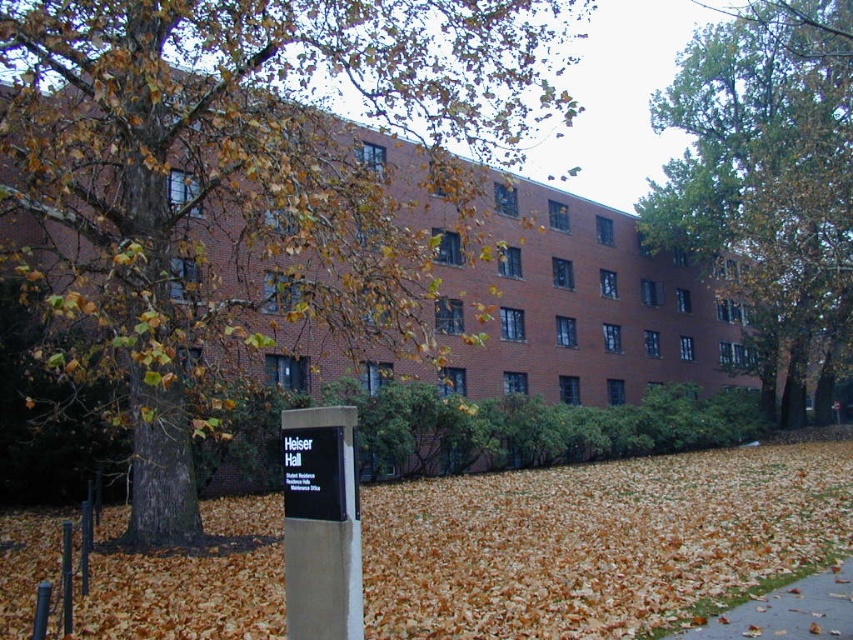
Based on the photo, is brown leafy tree at center behind brown leaf litter at lower center?

Yes, brown leafy tree at center is further from the viewer.

Is point (483, 115) positioned after point (231, 528)?

Yes, point (483, 115) is farther from viewer.

The width and height of the screenshot is (853, 640). What are the coordinates of `brown leafy tree at center` in the screenshot? It's located at (253, 179).

Does point (97, 627) come farther from viewer compared to point (846, 580)?

No, (97, 627) is closer to viewer.

Does point (412, 509) lie in front of point (824, 577)?

No, it is not.

Is point (701, 579) farther from viewer compared to point (850, 605)?

That is True.

At what (x,y) coordinates should I click in order to perform the action: click on brown leaf litter at lower center. Please return your answer as a coordinate pair (x, y). Looking at the image, I should click on (596, 541).

Looking at this image, which is below, brown leafy tree at center or green leafy tree at upper right?

green leafy tree at upper right

Which is behind, point (448, 184) or point (689, 212)?

The point (689, 212) is behind.

Who is more distant from viewer, (421, 317) or (692, 182)?

The point (692, 182) is more distant.

Identify the location of brown leafy tree at center. Image resolution: width=853 pixels, height=640 pixels. (253, 179).